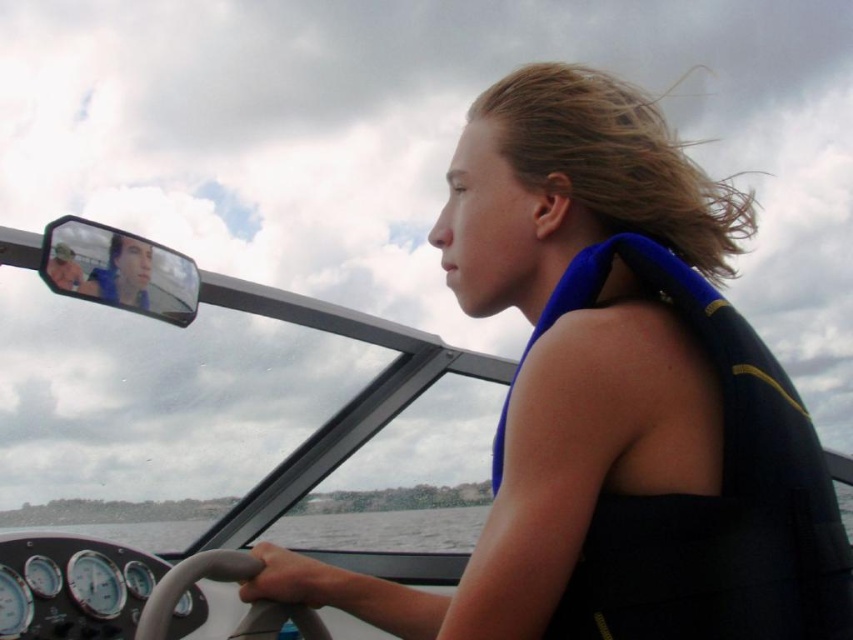
Who is positioned more to the left, blue neoprene life vest at center or blue fabric life jacket at center?

blue neoprene life vest at center is more to the left.

Is blue neoprene life vest at center above blue fabric life jacket at center?

Correct, blue neoprene life vest at center is located above blue fabric life jacket at center.

What do you see at coordinates (566, 344) in the screenshot? Image resolution: width=853 pixels, height=640 pixels. I see `blue neoprene life vest at center` at bounding box center [566, 344].

Find the location of a particular element. blue neoprene life vest at center is located at coordinates (566, 344).